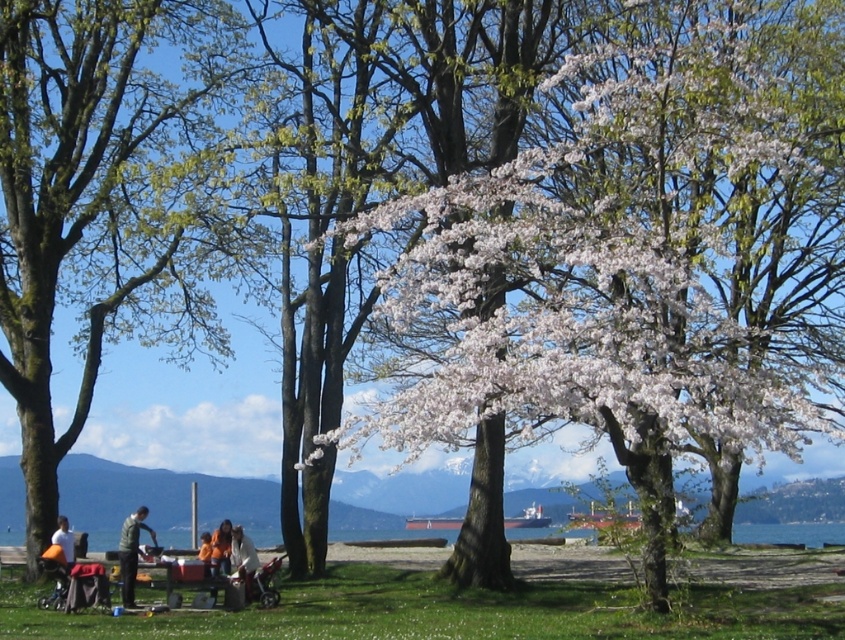
Question: Which point is farther to the camera?

Choices:
 (A) (134, 179)
 (B) (67, 557)
 (C) (135, 534)

Answer: (A)

Question: Which point appears closest to the camera in this image?

Choices:
 (A) (63, 548)
 (B) (35, 512)
 (C) (255, 570)
 (D) (417, 252)

Answer: (D)

Question: Considering the real-world distances, which object is closest to the orange fabric jacket at lower center?

Choices:
 (A) green fabric jacket at center
 (B) white cotton shirt at center
 (C) white blossoming tree at center
 (D) white cotton shirt at lower left

Answer: (B)

Question: Where is orange fabric picnic at lower left located in relation to green fabric jacket at center in the image?

Choices:
 (A) left
 (B) right

Answer: (B)

Question: Is orange fabric picnic at lower left bigger than white cotton shirt at center?

Choices:
 (A) yes
 (B) no

Answer: (A)

Question: From the image, what is the correct spatial relationship of orange fabric picnic at lower left in relation to white cotton shirt at lower left?

Choices:
 (A) below
 (B) above

Answer: (A)